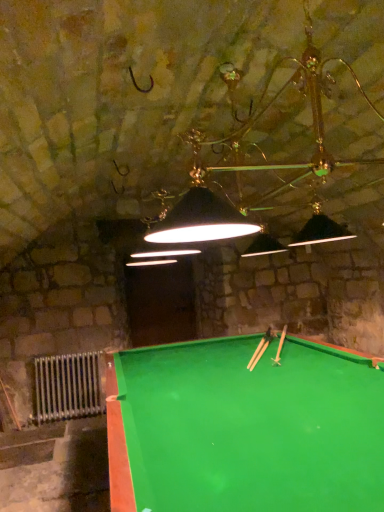
Question: Looking at the image, does wooden cue at center, the second cue positioned from the top, seem bigger or smaller compared to silver metallic radiator at lower left?

Choices:
 (A) small
 (B) big

Answer: (A)

Question: From a real-world perspective, is wooden cue at center, positioned as the first cue in bottom-to-top order, physically located above or below silver metallic radiator at lower left?

Choices:
 (A) above
 (B) below

Answer: (A)

Question: Estimate the real-world distances between objects in this image. Which object is closer to the green plastic cue at center, which is counted as the 2th cue, starting from the bottom?

Choices:
 (A) wooden cue at center, the second cue positioned from the top
 (B) green felt billiard table at center
 (C) silver metallic radiator at lower left

Answer: (A)

Question: Which of these objects is positioned closest to the green felt billiard table at center?

Choices:
 (A) silver metallic radiator at lower left
 (B) green plastic cue at center, which ranks as the 1th cue in top-to-bottom order
 (C) wooden cue at center, positioned as the first cue in bottom-to-top order

Answer: (C)